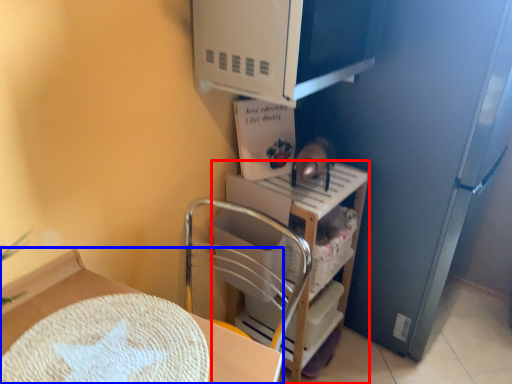
Question: Which object is further to the camera taking this photo, shelf (highlighted by a red box) or furniture (highlighted by a blue box)?

Choices:
 (A) shelf
 (B) furniture

Answer: (A)